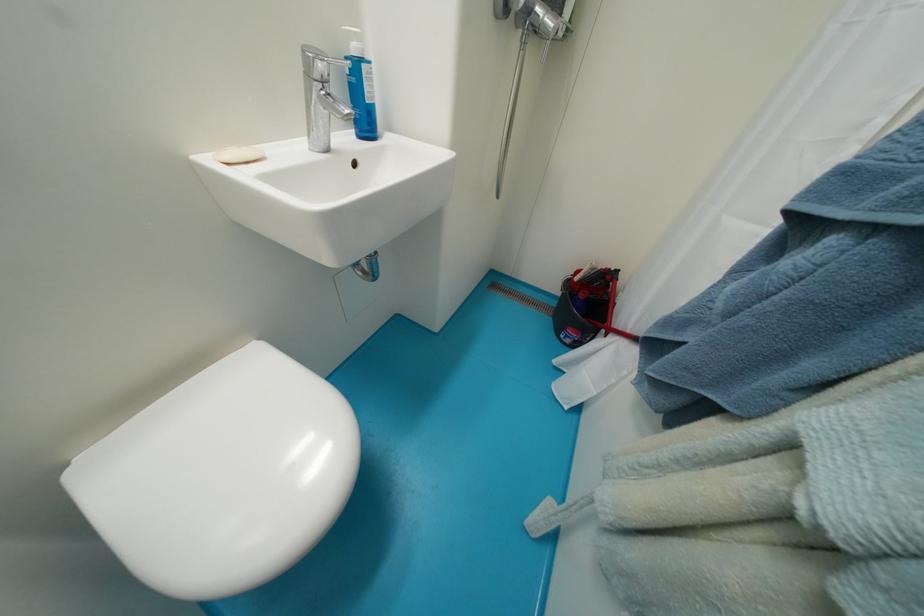
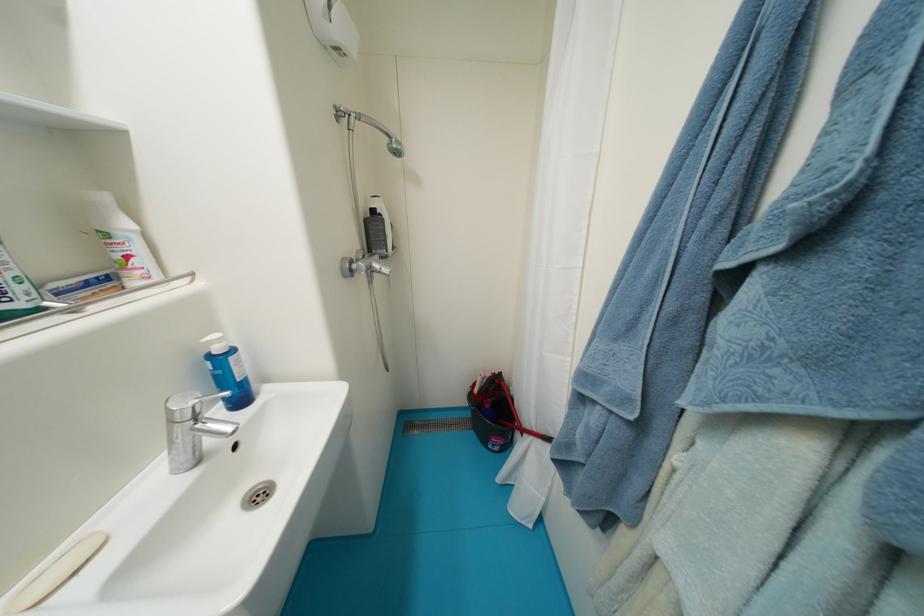
Locate, in the second image, the point that corresponds to (x=626, y=296) in the first image.

(517, 390)